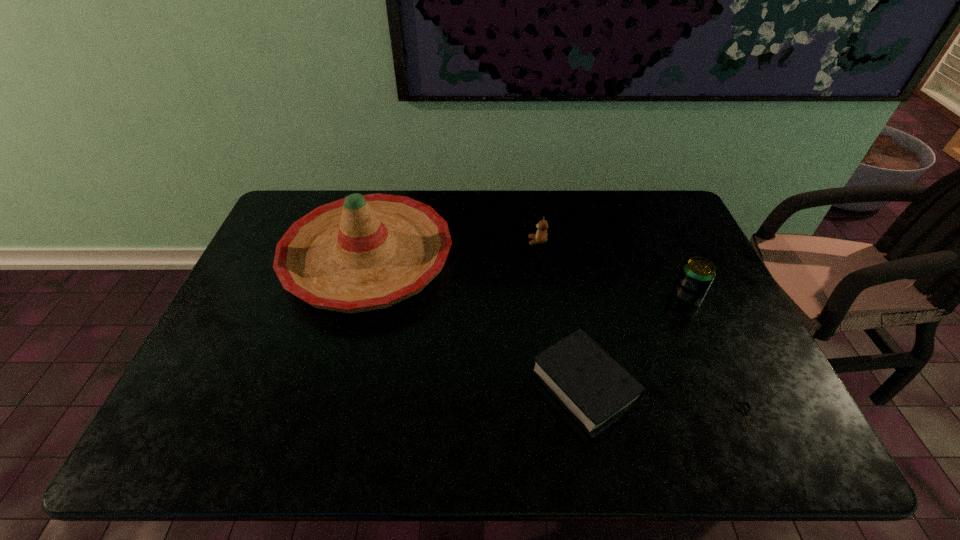
Locate an element on the screen. free space in the image that satisfies the following two spatial constraints: 1. on the front-facing side of the Bible; 2. on the left side of the third shortest object is located at coordinates (558, 386).

This screenshot has height=540, width=960. Find the location of `vacant area that satisfies the following two spatial constraints: 1. on the front-facing side of the third tallest object; 2. on the back side of the beer can`. vacant area that satisfies the following two spatial constraints: 1. on the front-facing side of the third tallest object; 2. on the back side of the beer can is located at coordinates (545, 298).

This screenshot has height=540, width=960. Find the location of `vacant region that satisfies the following two spatial constraints: 1. on the front-facing side of the third tallest object; 2. on the right side of the shortest object`. vacant region that satisfies the following two spatial constraints: 1. on the front-facing side of the third tallest object; 2. on the right side of the shortest object is located at coordinates (563, 421).

In order to click on free location that satisfies the following two spatial constraints: 1. on the back side of the fourth shortest object; 2. on the left side of the Bible in this screenshot , I will do `click(568, 298)`.

The image size is (960, 540). I want to click on free location that satisfies the following two spatial constraints: 1. on the front-facing side of the shortest object; 2. on the right side of the third tallest object, so click(563, 421).

In order to click on blank space that satisfies the following two spatial constraints: 1. on the front-facing side of the third tallest object; 2. on the front side of the leftmost object in this screenshot , I will do `click(540, 259)`.

Locate an element on the screen. This screenshot has width=960, height=540. vacant space that satisfies the following two spatial constraints: 1. on the front-facing side of the third shortest object; 2. on the right side of the second tallest object is located at coordinates (545, 298).